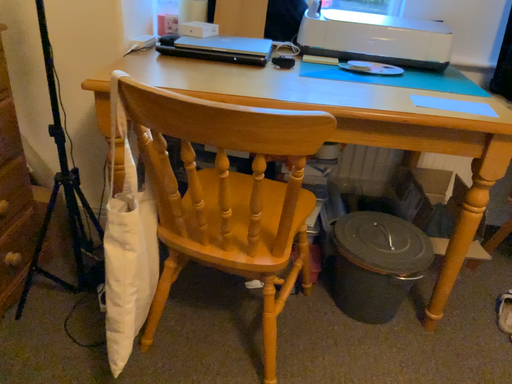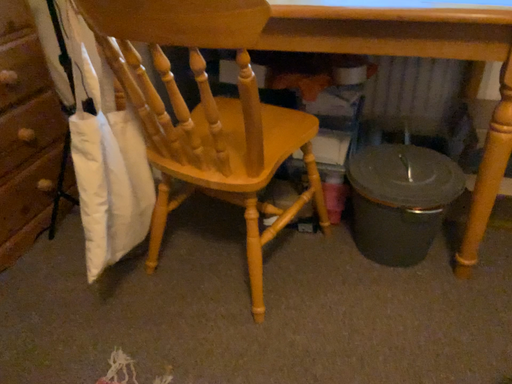
Question: Which way did the camera rotate in the video?

Choices:
 (A) rotated right
 (B) rotated left

Answer: (B)